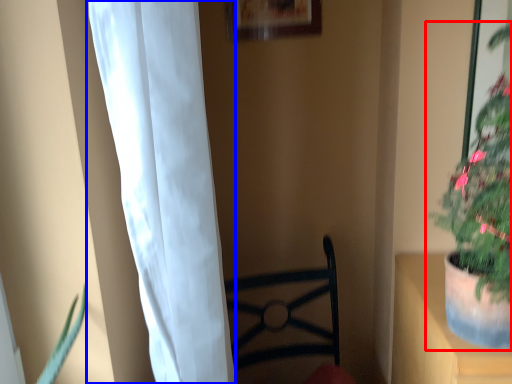
Question: Which object is closer to the camera taking this photo, houseplant (highlighted by a red box) or curtain (highlighted by a blue box)?

Choices:
 (A) houseplant
 (B) curtain

Answer: (A)